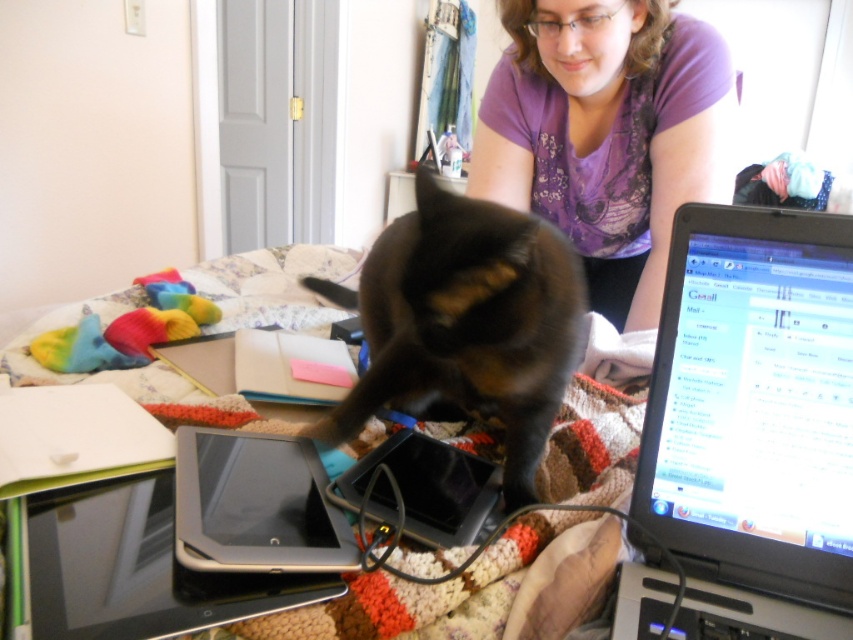
Question: Does brown fur cat at center have a larger size compared to black matte tablet at center?

Choices:
 (A) yes
 (B) no

Answer: (A)

Question: Is silver metallic laptop at right above purple printed shirt at upper center?

Choices:
 (A) no
 (B) yes

Answer: (A)

Question: Which point is closer to the camera?

Choices:
 (A) (653, 464)
 (B) (456, 220)
 (C) (85, 502)

Answer: (A)

Question: Does silver metallic laptop at right have a greater width compared to knitted blanket at center?

Choices:
 (A) no
 (B) yes

Answer: (A)

Question: Which point is farther to the camera?

Choices:
 (A) silver metallic tablet at lower left
 (B) black plastic tablet at center
 (C) brown fur cat at center
 (D) silver metallic laptop at right

Answer: (C)

Question: Which point is closer to the camera?

Choices:
 (A) silver metallic tablet at lower left
 (B) black plastic tablet at center

Answer: (A)